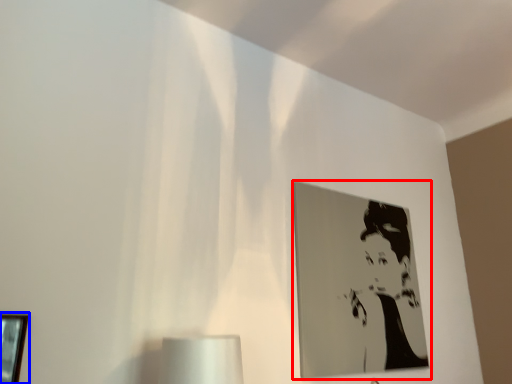
Question: Which object appears closest to the camera in this image, picture frame (highlighted by a red box) or picture frame (highlighted by a blue box)?

Choices:
 (A) picture frame
 (B) picture frame

Answer: (B)